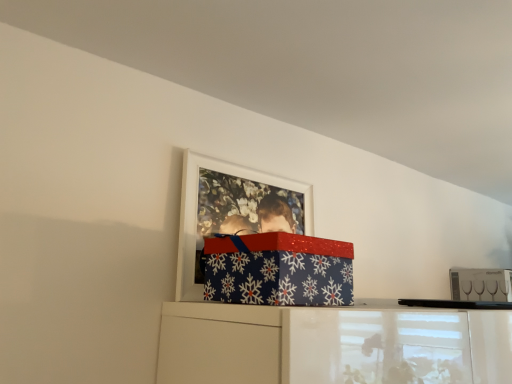
Measure the distance between clear glass wine glasses at upper right and camera.

They are 1.64 meters apart.

At what (x,y) coordinates should I click in order to perform the action: click on blue paper with snowflakes at upper center. Please return your answer as a coordinate pair (x, y). Looking at the image, I should click on (278, 270).

Image resolution: width=512 pixels, height=384 pixels. What do you see at coordinates (278, 270) in the screenshot?
I see `blue paper with snowflakes at upper center` at bounding box center [278, 270].

Locate an element on the screen. The height and width of the screenshot is (384, 512). clear glass wine glasses at upper right is located at coordinates (481, 284).

Consider the image. From the image's perspective, would you say white matte picture frame at upper center is shown under blue paper with snowflakes at upper center?

No.

Who is shorter, white matte picture frame at upper center or blue paper with snowflakes at upper center?

blue paper with snowflakes at upper center.

Does white matte picture frame at upper center have a larger size compared to blue paper with snowflakes at upper center?

Actually, white matte picture frame at upper center might be smaller than blue paper with snowflakes at upper center.

Is white matte picture frame at upper center facing away from blue paper with snowflakes at upper center?

Yes, white matte picture frame at upper center is positioned with its back facing blue paper with snowflakes at upper center.

Who is more distant, blue paper with snowflakes at upper center or clear glass wine glasses at upper right?

clear glass wine glasses at upper right is further from the camera.

Could you tell me if blue paper with snowflakes at upper center is turned towards clear glass wine glasses at upper right?

No, blue paper with snowflakes at upper center is not facing towards clear glass wine glasses at upper right.

From the image's perspective, which is above, blue paper with snowflakes at upper center or clear glass wine glasses at upper right?

blue paper with snowflakes at upper center.

Which object is positioned more to the left, blue paper with snowflakes at upper center or clear glass wine glasses at upper right?

Positioned to the left is blue paper with snowflakes at upper center.

Which object is thinner, blue paper with snowflakes at upper center or white matte picture frame at upper center?

white matte picture frame at upper center.

Which is less distant, [223,241] or [293,182]?

Point [223,241] is positioned closer to the camera compared to point [293,182].

From the image's perspective, which one is positioned higher, blue paper with snowflakes at upper center or white matte picture frame at upper center?

white matte picture frame at upper center is shown above in the image.

Which of these two, blue paper with snowflakes at upper center or white matte picture frame at upper center, is smaller?

white matte picture frame at upper center is smaller.

Considering the relative sizes of white matte picture frame at upper center and clear glass wine glasses at upper right in the image provided, is white matte picture frame at upper center taller than clear glass wine glasses at upper right?

Yes.

Is white matte picture frame at upper center located outside clear glass wine glasses at upper right?

white matte picture frame at upper center lies outside clear glass wine glasses at upper right's area.

From the image's perspective, does white matte picture frame at upper center appear higher than clear glass wine glasses at upper right?

Yes, from the image's perspective, white matte picture frame at upper center is on top of clear glass wine glasses at upper right.

Is point (476, 281) more distant than point (268, 302)?

That is True.

Considering the relative sizes of clear glass wine glasses at upper right and blue paper with snowflakes at upper center in the image provided, is clear glass wine glasses at upper right thinner than blue paper with snowflakes at upper center?

Indeed, clear glass wine glasses at upper right has a lesser width compared to blue paper with snowflakes at upper center.

Is clear glass wine glasses at upper right positioned beyond the bounds of white matte picture frame at upper center?

Absolutely, clear glass wine glasses at upper right is external to white matte picture frame at upper center.

Based on the photo, between clear glass wine glasses at upper right and white matte picture frame at upper center, which one has more height?

With more height is white matte picture frame at upper center.

From the image's perspective, between clear glass wine glasses at upper right and white matte picture frame at upper center, who is located below?

clear glass wine glasses at upper right is shown below in the image.

Does point (497, 299) come in front of point (198, 158)?

No, it is behind (198, 158).

This screenshot has height=384, width=512. Identify the location of package located underneath the white matte picture frame at upper center (from a real-world perspective). (278, 270).

At what (x,y) coordinates should I click in order to perform the action: click on package in front of the clear glass wine glasses at upper right. Please return your answer as a coordinate pair (x, y). Looking at the image, I should click on (278, 270).

When comparing their distances from blue paper with snowflakes at upper center, does white matte picture frame at upper center or clear glass wine glasses at upper right seem further?

The object further to blue paper with snowflakes at upper center is clear glass wine glasses at upper right.

Which object lies further to the anchor point white matte picture frame at upper center, clear glass wine glasses at upper right or blue paper with snowflakes at upper center?

clear glass wine glasses at upper right lies further to white matte picture frame at upper center than the other object.

Considering their positions, is blue paper with snowflakes at upper center positioned closer to white matte picture frame at upper center than clear glass wine glasses at upper right?

blue paper with snowflakes at upper center is positioned closer to the anchor white matte picture frame at upper center.

From the picture: From the image, which object appears to be farther from clear glass wine glasses at upper right, white matte picture frame at upper center or blue paper with snowflakes at upper center?

Among the two, blue paper with snowflakes at upper center is located further to clear glass wine glasses at upper right.

Looking at the image, which one is located closer to clear glass wine glasses at upper right, blue paper with snowflakes at upper center or white matte picture frame at upper center?

Based on the image, white matte picture frame at upper center appears to be nearer to clear glass wine glasses at upper right.

Which object lies further to the anchor point blue paper with snowflakes at upper center, clear glass wine glasses at upper right or white matte picture frame at upper center?

clear glass wine glasses at upper right.

At what (x,y) coordinates should I click in order to perform the action: click on package between white matte picture frame at upper center and clear glass wine glasses at upper right in the horizontal direction. Please return your answer as a coordinate pair (x, y). Looking at the image, I should click on (278, 270).